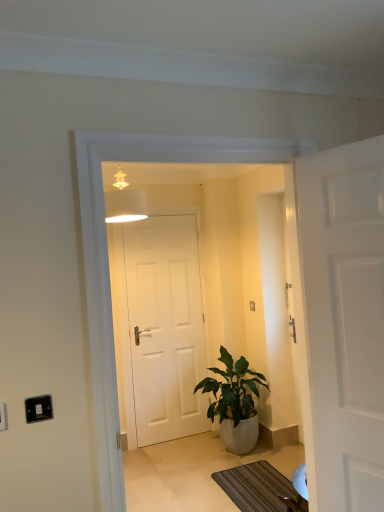
At what (x,y) coordinates should I click in order to perform the action: click on blank area to the left of green glossy plant at center. Please return your answer as a coordinate pair (x, y). Looking at the image, I should click on (178, 456).